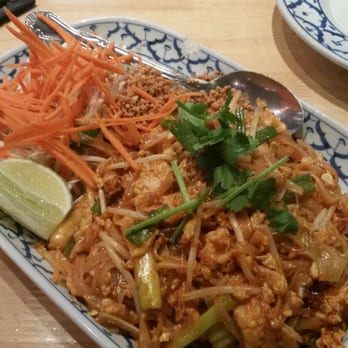
The height and width of the screenshot is (348, 348). Identify the location of light wooden surface. 240,28.